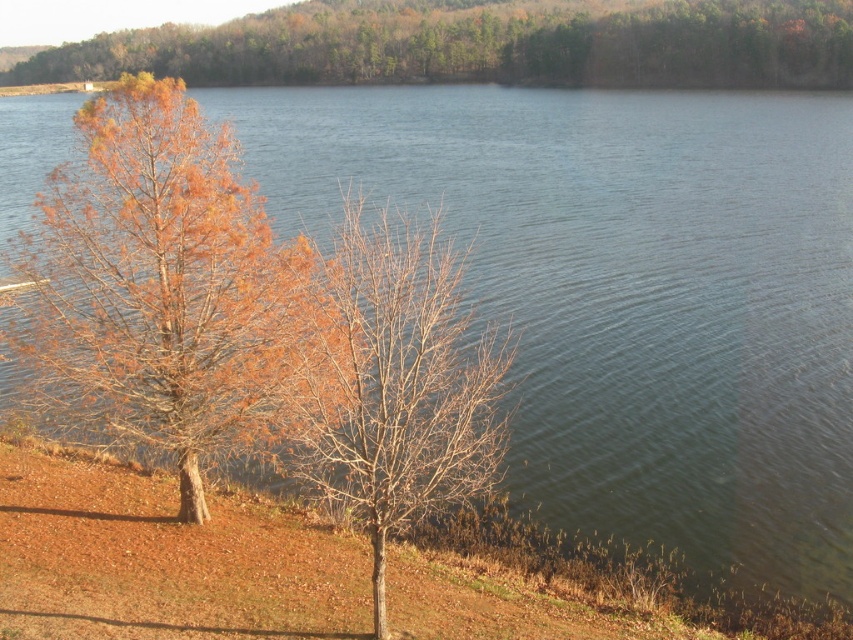
Consider the image. Who is shorter, orange-brown wood tree at left or bare branches at center?

bare branches at center is shorter.

Does orange-brown wood tree at left come behind bare branches at center?

Yes, it is behind bare branches at center.

Does point (73, 349) come farther from viewer compared to point (328, 406)?

Yes, it is behind point (328, 406).

Find the location of a particular element. The width and height of the screenshot is (853, 640). orange-brown wood tree at left is located at coordinates (161, 288).

Which of these two, brown leafy tree at upper center or bare branches at center, stands taller?

brown leafy tree at upper center

How far apart are brown leafy tree at upper center and bare branches at center?

The distance of brown leafy tree at upper center from bare branches at center is 122.37 meters.

Who is more distant from viewer, (273, 52) or (432, 420)?

Point (273, 52)

Find the location of a particular element. This screenshot has height=640, width=853. brown leafy tree at upper center is located at coordinates (485, 44).

Where is `orange-brown wood tree at left`? orange-brown wood tree at left is located at coordinates (161, 288).

Find the location of a particular element. This screenshot has width=853, height=640. orange-brown wood tree at left is located at coordinates (161, 288).